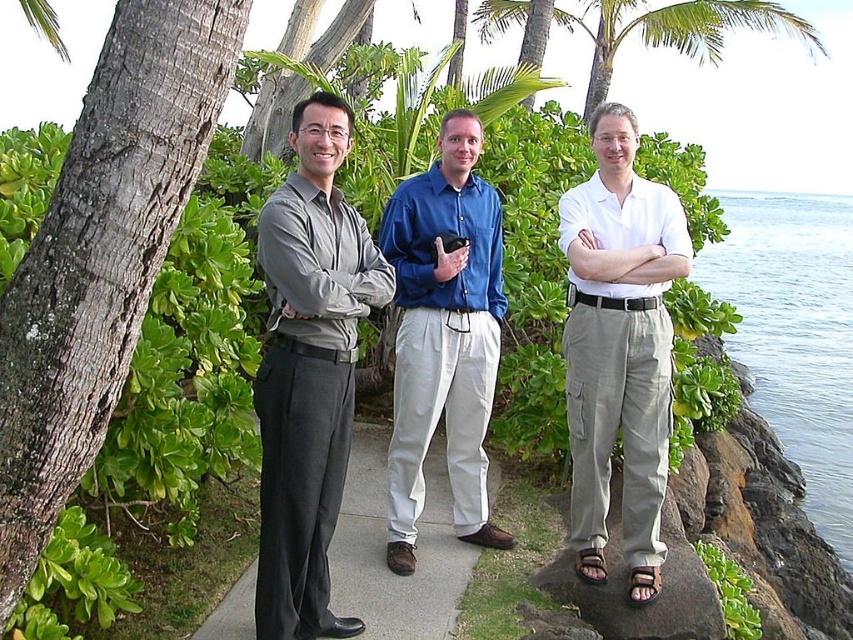
You are a photographer trying to capture a group photo of the matte gray shirt at center and the white cotton shirt at center. Since you want to ensure both are clearly visible, which shirt should you focus on first to account for their sizes?

The matte gray shirt at center is smaller than the white cotton shirt at center, so you should focus on the matte gray shirt at center first to ensure its details are captured clearly before adjusting for the larger one.

You are a photographer planning to take a group photo of the three men in the scene. You want to ensure that the blue liquid water at right and the green leafy palm tree at upper center are both visible in the background. Based on their positions, which object will appear larger in the photo?

The blue liquid water at right will appear larger in the photo because it is taller than the green leafy palm tree at upper center.